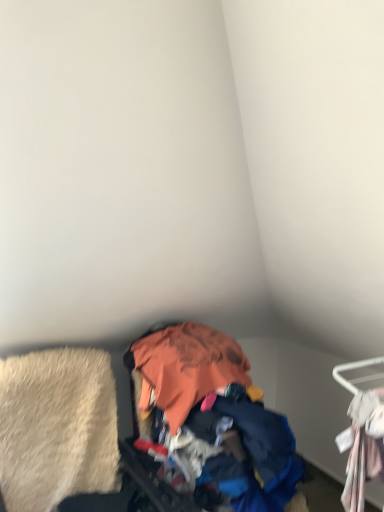
Question: From a real-world perspective, does beige shag rug at lower left stand above white fabric hanger at right?

Choices:
 (A) yes
 (B) no

Answer: (B)

Question: Considering the relative sizes of beige shag rug at lower left and white fabric hanger at right in the image provided, is beige shag rug at lower left taller than white fabric hanger at right?

Choices:
 (A) no
 (B) yes

Answer: (B)

Question: Is beige shag rug at lower left in contact with white fabric hanger at right?

Choices:
 (A) yes
 (B) no

Answer: (B)

Question: Considering the relative sizes of beige shag rug at lower left and white fabric hanger at right in the image provided, is beige shag rug at lower left thinner than white fabric hanger at right?

Choices:
 (A) yes
 (B) no

Answer: (B)

Question: Considering the relative positions of beige shag rug at lower left and white fabric hanger at right in the image provided, is beige shag rug at lower left in front of white fabric hanger at right?

Choices:
 (A) yes
 (B) no

Answer: (B)

Question: Does beige shag rug at lower left appear on the left side of white fabric hanger at right?

Choices:
 (A) no
 (B) yes

Answer: (B)

Question: From a real-world perspective, is white fabric hanger at right over beige shag rug at lower left?

Choices:
 (A) yes
 (B) no

Answer: (A)

Question: Does white fabric hanger at right appear on the left side of beige shag rug at lower left?

Choices:
 (A) yes
 (B) no

Answer: (B)

Question: From the image's perspective, is white fabric hanger at right beneath beige shag rug at lower left?

Choices:
 (A) no
 (B) yes

Answer: (A)

Question: Does white fabric hanger at right appear on the right side of beige shag rug at lower left?

Choices:
 (A) yes
 (B) no

Answer: (A)

Question: Is white fabric hanger at right taller than beige shag rug at lower left?

Choices:
 (A) yes
 (B) no

Answer: (B)

Question: Would you say white fabric hanger at right contains beige shag rug at lower left?

Choices:
 (A) yes
 (B) no

Answer: (B)

Question: Is orange fabric pile at center turned away from white fabric hanger at right?

Choices:
 (A) yes
 (B) no

Answer: (B)